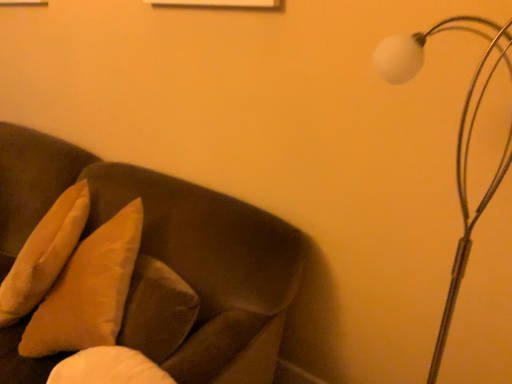
Question: Should I look upward or downward to see white matte lamp at upper right?

Choices:
 (A) down
 (B) up

Answer: (A)

Question: Is soft beige pillow at left positioned behind white matte lamp at upper right?

Choices:
 (A) no
 (B) yes

Answer: (B)

Question: Are soft beige pillow at left and white matte lamp at upper right beside each other?

Choices:
 (A) yes
 (B) no

Answer: (B)

Question: Does soft beige pillow at left come in front of white matte lamp at upper right?

Choices:
 (A) no
 (B) yes

Answer: (A)

Question: Is soft beige pillow at left wider than white matte lamp at upper right?

Choices:
 (A) no
 (B) yes

Answer: (B)

Question: From a real-world perspective, is soft beige pillow at left physically below white matte lamp at upper right?

Choices:
 (A) yes
 (B) no

Answer: (A)

Question: Is there a large distance between soft beige pillow at left and white matte lamp at upper right?

Choices:
 (A) no
 (B) yes

Answer: (B)

Question: From a real-world perspective, is soft beige pillow at left over suede-like brown couch at left?

Choices:
 (A) no
 (B) yes

Answer: (B)

Question: Is soft beige pillow at left to the right of suede-like brown couch at left from the viewer's perspective?

Choices:
 (A) no
 (B) yes

Answer: (B)

Question: Is soft beige pillow at left oriented towards suede-like brown couch at left?

Choices:
 (A) no
 (B) yes

Answer: (B)

Question: Is soft beige pillow at left bigger than suede-like brown couch at left?

Choices:
 (A) yes
 (B) no

Answer: (B)

Question: Is soft beige pillow at left with suede-like brown couch at left?

Choices:
 (A) no
 (B) yes

Answer: (A)

Question: Is soft beige pillow at left looking in the opposite direction of suede-like brown couch at left?

Choices:
 (A) no
 (B) yes

Answer: (B)

Question: From a real-world perspective, is white matte lamp at upper right positioned over soft beige pillow at left based on gravity?

Choices:
 (A) yes
 (B) no

Answer: (A)